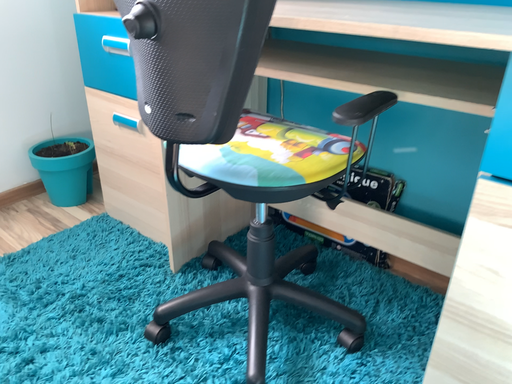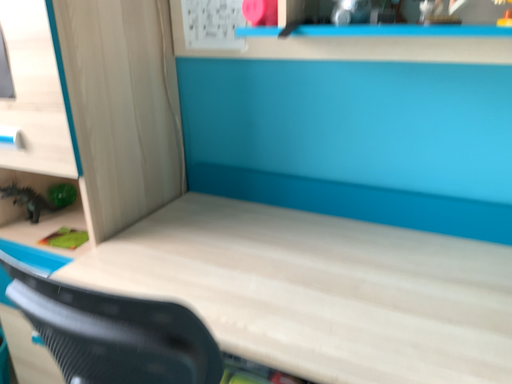
Question: How did the camera likely rotate when shooting the video?

Choices:
 (A) rotated downward
 (B) rotated upward

Answer: (B)